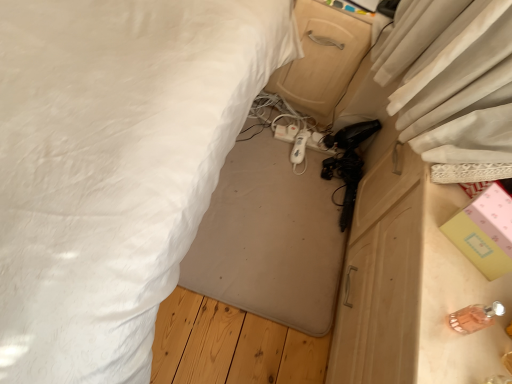
Where is `free space in front of white matte remote control at center, placed as the first equipment when sorted from back to front`? The width and height of the screenshot is (512, 384). free space in front of white matte remote control at center, placed as the first equipment when sorted from back to front is located at coordinates (281, 176).